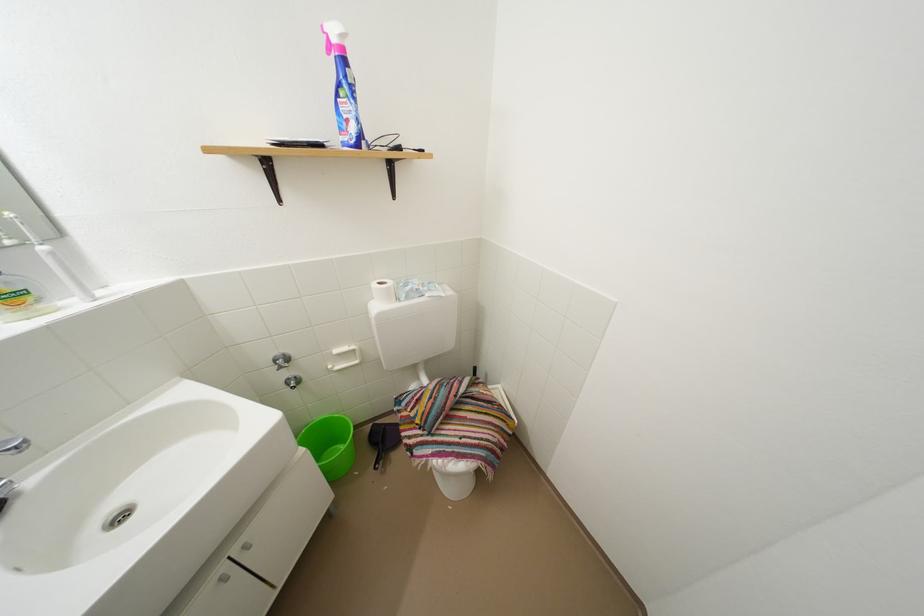
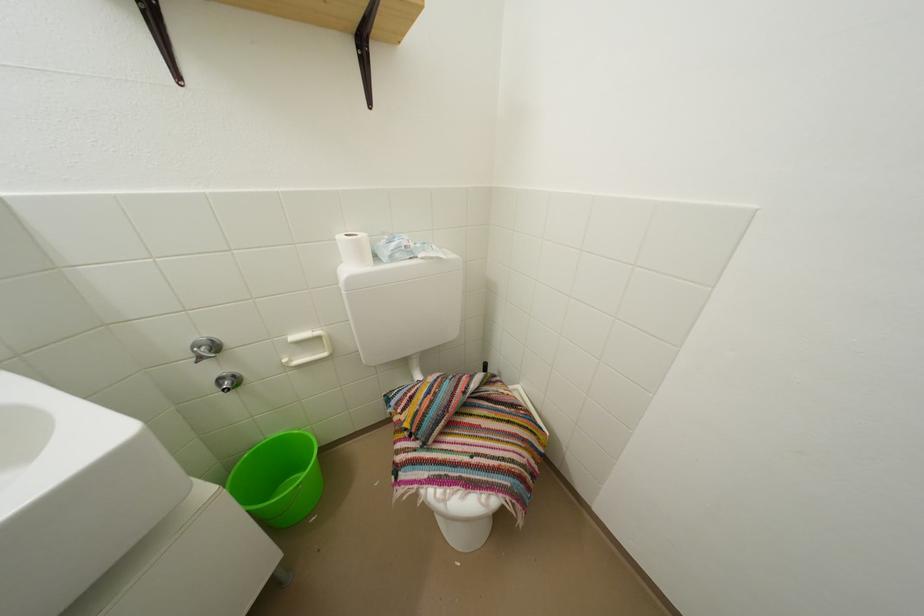
The point at (x=297, y=387) is marked in the first image. Where is the corresponding point in the second image?

(229, 386)